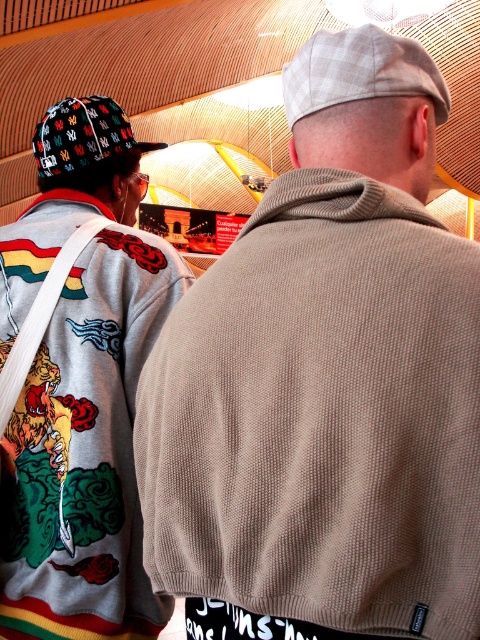
You are standing in the room and want to take a photo of both the point at location (124,337) and the point at location (49,129). Which point will appear larger in your camera view?

Point at location (124,337) will appear larger because it is closer to the camera than point at location (49,129).

You are a security guard in the building and need to describe the clothing items of two people standing in the center area. Which clothing item is positioned lower on their body between the beige textured sweater at center and the light gray plaid baseball cap at upper center?

The beige textured sweater at center is positioned lower on their body than the light gray plaid baseball cap at upper center, which is located above it.